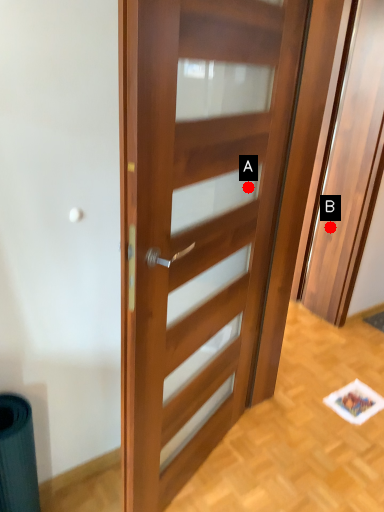
Question: Two points are circled on the image, labeled by A and B beside each circle. Which point appears closest to the camera in this image?

Choices:
 (A) A is closer
 (B) B is closer

Answer: (A)